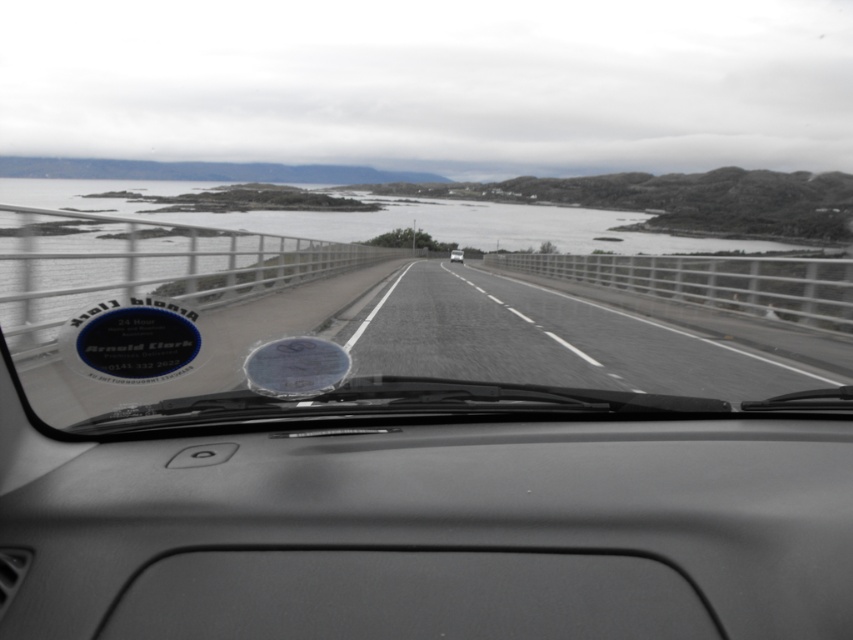
Is point (610, 301) behind point (453, 260)?

No, (610, 301) is in front of (453, 260).

Measure the distance between transparent glass windshield at center and camera.

The distance of transparent glass windshield at center from camera is 9.68 feet.

Does point (630, 285) come behind point (456, 259)?

No, it is in front of (456, 259).

Locate an element on the screen. This screenshot has height=640, width=853. transparent glass windshield at center is located at coordinates (408, 300).

Is matte gray dashboard at center above white glossy car at center?

No.

Which is below, matte gray dashboard at center or white glossy car at center?

matte gray dashboard at center is lower down.

The image size is (853, 640). Find the location of `matte gray dashboard at center`. matte gray dashboard at center is located at coordinates (469, 518).

Is matte gray dashboard at center to the left of transparent glass windshield at center from the viewer's perspective?

In fact, matte gray dashboard at center is to the right of transparent glass windshield at center.

Identify the location of matte gray dashboard at center. The height and width of the screenshot is (640, 853). (469, 518).

Does point (68, 468) lie in front of point (90, 401)?

That is True.

Locate an element on the screen. The width and height of the screenshot is (853, 640). matte gray dashboard at center is located at coordinates (469, 518).